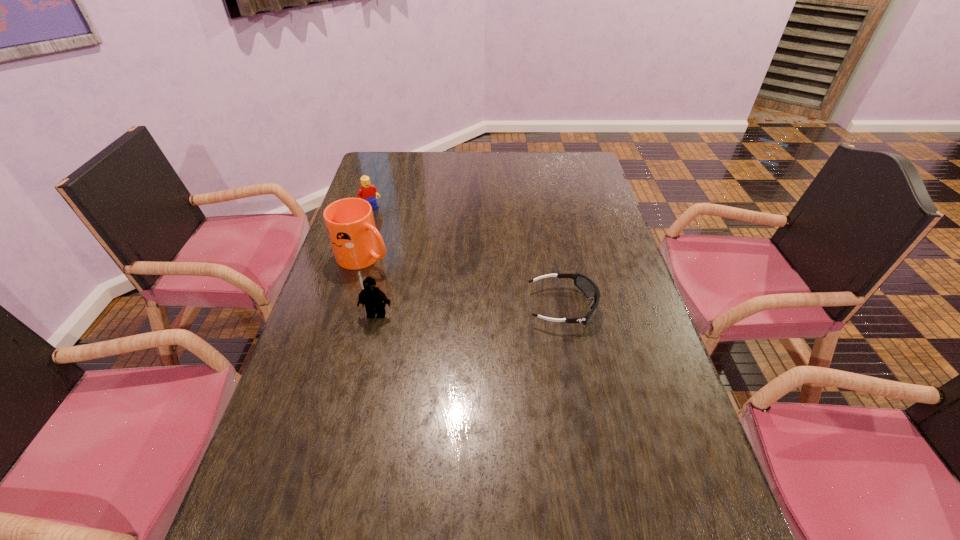
The height and width of the screenshot is (540, 960). What are the coordinates of `vacant space at the right edge` in the screenshot? It's located at (592, 208).

The width and height of the screenshot is (960, 540). Identify the location of vacant area at the near right corner. (712, 485).

Where is `free space between the right Lego and the goggles`? This screenshot has height=540, width=960. free space between the right Lego and the goggles is located at coordinates (469, 310).

Identify the location of free spot between the tallest object and the goggles. (464, 282).

Image resolution: width=960 pixels, height=540 pixels. In order to click on unoccupied area between the rightmost object and the right Lego in this screenshot , I will do `click(469, 310)`.

Identify which object is located as the nearest to the shortest object. Please provide its 2D coordinates. Your answer should be formatted as a tuple, i.e. [(x, y)], where the tuple contains the x and y coordinates of a point satisfying the conditions above.

[(372, 297)]

The height and width of the screenshot is (540, 960). Find the location of `object that can be found as the third closest to the goggles`. object that can be found as the third closest to the goggles is located at coordinates (368, 192).

Locate an element on the screen. This screenshot has height=540, width=960. free point that satisfies the following two spatial constraints: 1. on the front side of the tallest object; 2. on the front and sides of the shortest object is located at coordinates (x=349, y=307).

Find the location of a particular element. This screenshot has height=540, width=960. vacant area in the image that satisfies the following two spatial constraints: 1. on the front side of the shortest object; 2. on the front and sides of the farthest object is located at coordinates (340, 307).

Identify the location of free location that satisfies the following two spatial constraints: 1. on the front side of the shortest object; 2. on the front and sides of the tallest object. The image size is (960, 540). (349, 307).